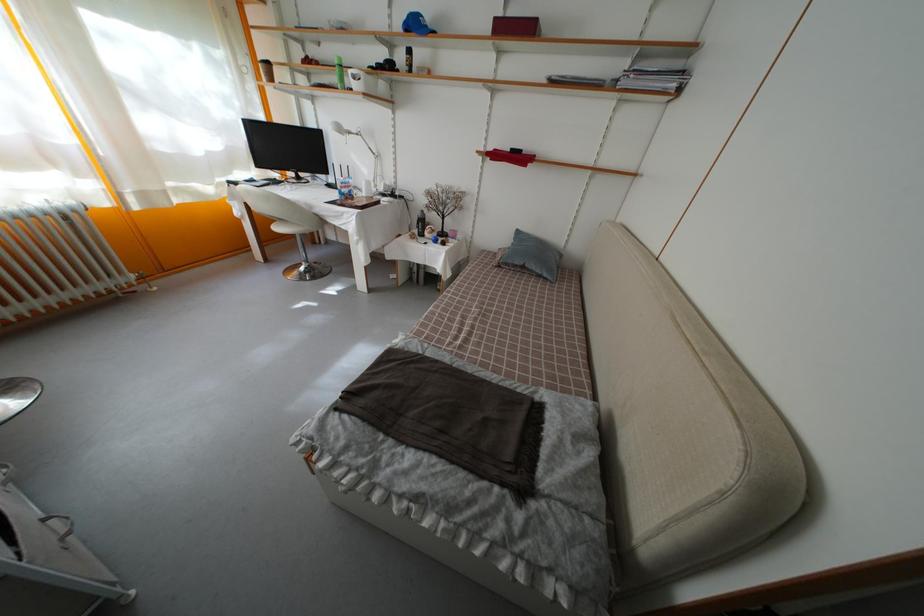
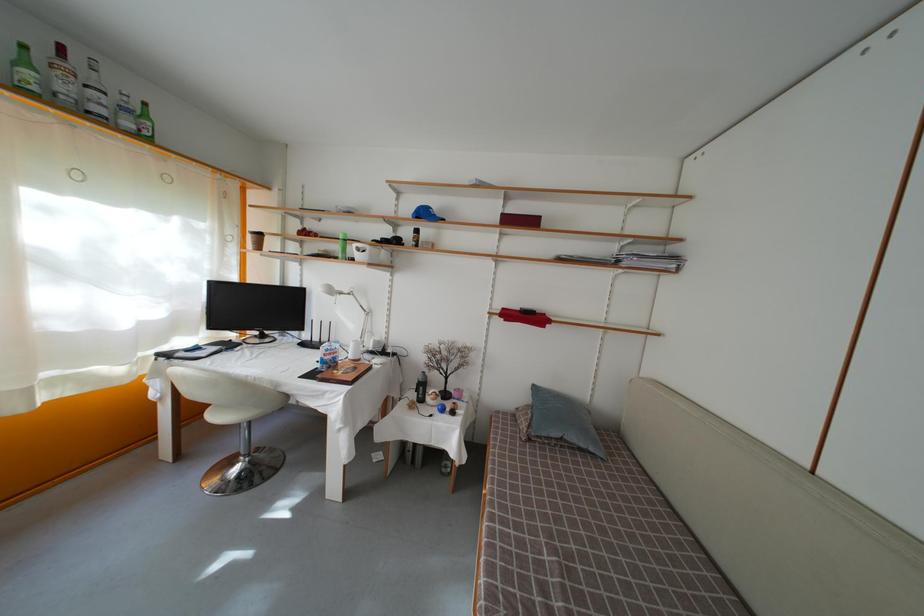
The point at [360,92] is marked in the first image. Where is the corresponding point in the second image?

(363, 262)